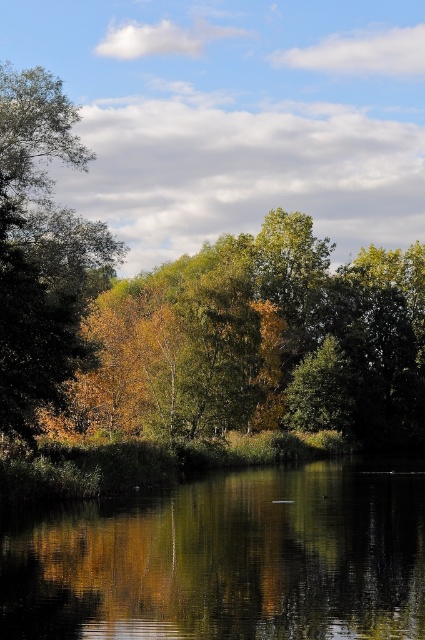
You are standing at the edge of the water and see the golden leaves at center and the green reflective water at center. Which object is positioned higher in the scene?

The golden leaves at center are located above the green reflective water at center, so they are positioned higher in the scene.

You are standing in the serene natural scene and want to pick up the golden leaves at center and the green reflective water at center. Which object is closer to you?

The golden leaves at center are closer to you than the green reflective water at center because the golden leaves at center is further to the viewer than green reflective water at center.

You are standing at the edge of the water in the serene natural scene. There are golden leaves at center. Can you see the golden leaves at center and the point represented by point (192, 314) in the same direction?

The golden leaves at center is represented by point (192, 314), so yes, you can see them in the same direction.